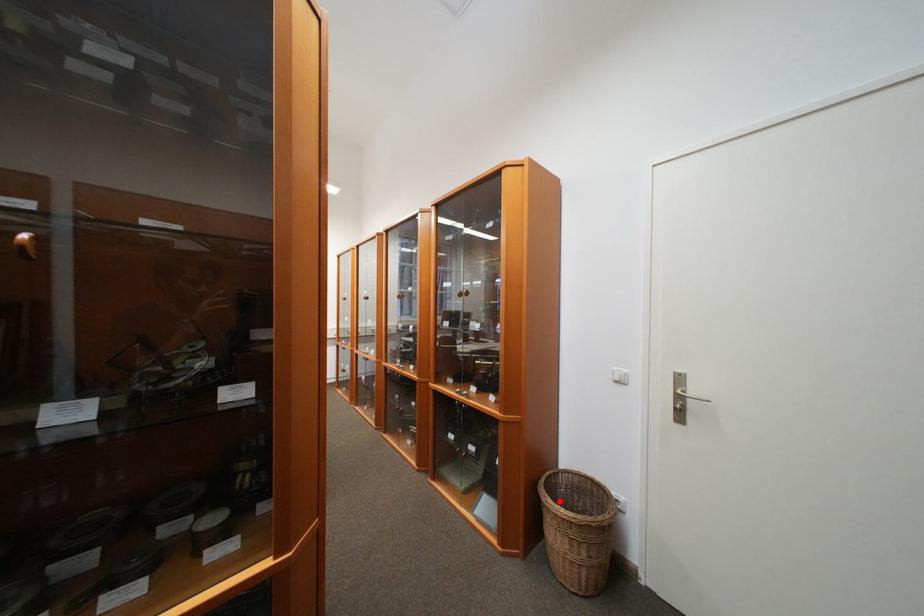
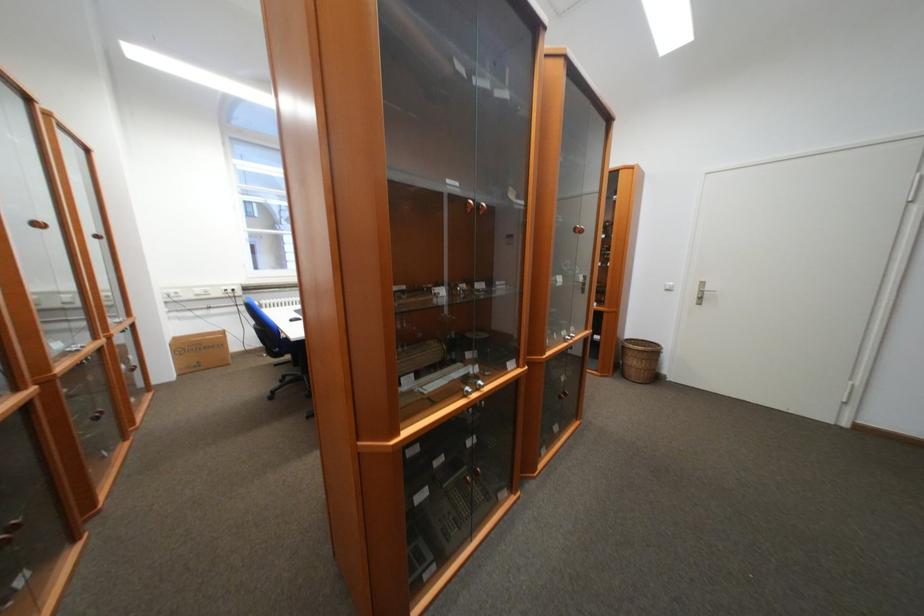
Locate, in the second image, the point that corresponds to the highlighted location in the first image.

(640, 347)